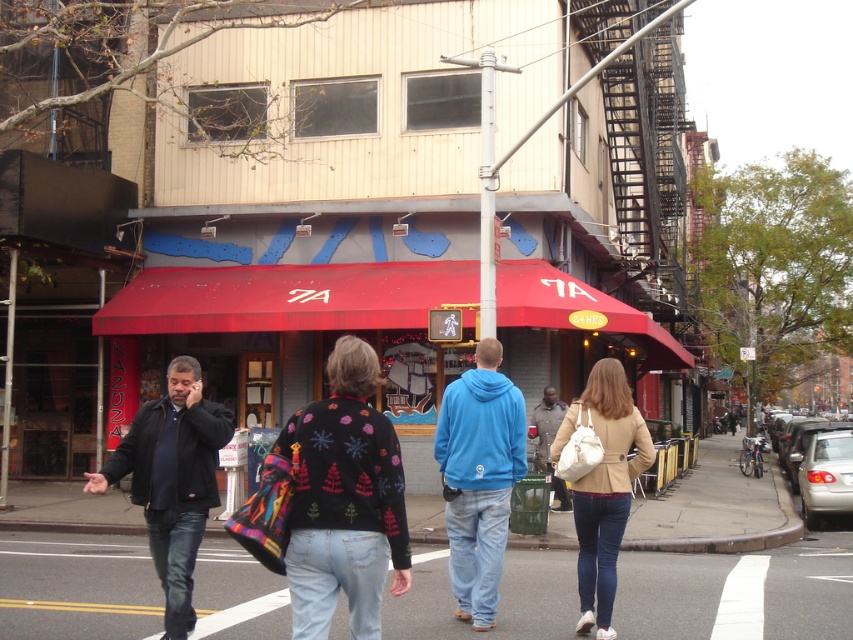
From the picture: You are a fashion designer observing the urban street scene. You notice a person wearing a black sweater with colorful patterns at center. Can you determine the exact 2D coordinates of where this sweater is positioned in the image?

The black sweater with colorful patterns at center is located at the 2D coordinates of point (344, 500).